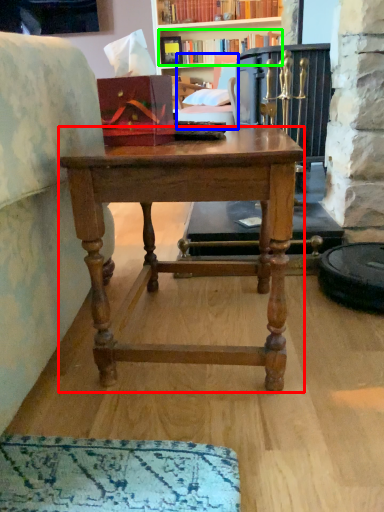
Question: Based on their relative distances, which object is farther from desk (highlighted by a red box)? Choose from swivel chair (highlighted by a blue box) and book (highlighted by a green box).

Choices:
 (A) swivel chair
 (B) book

Answer: (B)